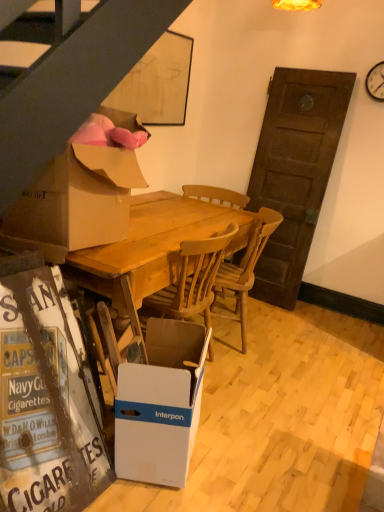
The image size is (384, 512). What do you see at coordinates (245, 269) in the screenshot?
I see `wooden chair at center` at bounding box center [245, 269].

This screenshot has height=512, width=384. What do you see at coordinates (161, 404) in the screenshot? I see `white cardboard box at lower center, acting as the first box starting from the bottom` at bounding box center [161, 404].

This screenshot has height=512, width=384. I want to click on white cardboard at lower left, so click(x=45, y=404).

Locate an element on the screen. wooden chair at center is located at coordinates (245, 269).

Between white plastic clock at upper right and wooden table at center, which one has more height?

wooden table at center.

From a real-world perspective, who is located higher, white plastic clock at upper right or wooden table at center?

white plastic clock at upper right is physically above.

From the image's perspective, is white plastic clock at upper right below wooden table at center?

No, from the image's perspective, white plastic clock at upper right is not below wooden table at center.

Is point (367, 77) more distant than point (161, 211)?

Yes, point (367, 77) is farther from viewer.

Who is bigger, white plastic clock at upper right or cardboard box at left, the 1th box in the top-to-bottom sequence?

cardboard box at left, the 1th box in the top-to-bottom sequence.

Can we say white plastic clock at upper right lies outside cardboard box at left, the 1th box in the top-to-bottom sequence?

white plastic clock at upper right is positioned outside cardboard box at left, the 1th box in the top-to-bottom sequence.

Is white plastic clock at upper right positioned in front of cardboard box at left, the 2th box from the bottom?

No.

Would you consider white plastic clock at upper right to be distant from cardboard box at left, the 2th box from the bottom?

white plastic clock at upper right is positioned a significant distance from cardboard box at left, the 2th box from the bottom.

Consider the image. From a real-world perspective, which is physically above, wooden table at center or white cardboard at lower left?

wooden table at center, from a real-world perspective.

Can you tell me how much wooden table at center and white cardboard at lower left differ in facing direction?

The angle between the facing direction of wooden table at center and the facing direction of white cardboard at lower left is 176 degrees.

Considering the sizes of objects wooden table at center and white cardboard at lower left in the image provided, who is taller, wooden table at center or white cardboard at lower left?

white cardboard at lower left.

Is white cardboard at lower left at the back of wooden table at center?

No, white cardboard at lower left is not at the back of wooden table at center.

Is wooden chair at center positioned before white cardboard at lower left?

No, wooden chair at center is further to the viewer.

Can we say wooden chair at center lies outside white cardboard at lower left?

Indeed, wooden chair at center is completely outside white cardboard at lower left.

Which is more to the left, wooden chair at center or white cardboard at lower left?

Positioned to the left is white cardboard at lower left.

From the image's perspective, is white plastic clock at upper right on white cardboard at lower left?

Indeed, from the image's perspective, white plastic clock at upper right is shown above white cardboard at lower left.

Where is `clock above the white cardboard at lower left (from a real-world perspective)`? clock above the white cardboard at lower left (from a real-world perspective) is located at coordinates (376, 82).

From a real-world perspective, between white plastic clock at upper right and white cardboard at lower left, who is vertically higher?

white plastic clock at upper right, from a real-world perspective.

Is the position of white plastic clock at upper right more distant than that of white cardboard at lower left?

Yes, it is.

Is wooden chair at center inside the boundaries of white cardboard box at lower center, the 2th box positioned from the top, or outside?

wooden chair at center lies outside white cardboard box at lower center, the 2th box positioned from the top.

Visually, is wooden chair at center positioned to the left or to the right of white cardboard box at lower center, the 2th box positioned from the top?

wooden chair at center is positioned on white cardboard box at lower center, the 2th box positioned from the top,'s right side.

Does wooden chair at center have a lesser height compared to white cardboard box at lower center, the 2th box positioned from the top?

Incorrect, the height of wooden chair at center does not fall short of that of white cardboard box at lower center, the 2th box positioned from the top.

Considering the sizes of objects white cardboard at lower left and white plastic clock at upper right in the image provided, who is shorter, white cardboard at lower left or white plastic clock at upper right?

white plastic clock at upper right.

Is white cardboard at lower left closer to camera compared to white plastic clock at upper right?

Yes, white cardboard at lower left is in front of white plastic clock at upper right.

From the image's perspective, is white cardboard at lower left below white plastic clock at upper right?

Yes, from the image's perspective, white cardboard at lower left is below white plastic clock at upper right.

Can you confirm if white cardboard at lower left is wider than white plastic clock at upper right?

Yes, white cardboard at lower left is wider than white plastic clock at upper right.

The width and height of the screenshot is (384, 512). I want to click on round table in front of the white plastic clock at upper right, so click(x=152, y=247).

You are a GUI agent. You are given a task and a screenshot of the screen. Output one action in this format:
    pyautogui.click(x=<x>, y=<y>)
    Task: Click on the clock above the cardboard box at left, the 1th box in the top-to-bottom sequence (from the image's perspective)
    The image size is (384, 512).
    Given the screenshot: What is the action you would take?
    pyautogui.click(x=376, y=82)

From the image, which object appears to be nearer to white cardboard at lower left, white plastic clock at upper right or cardboard box at left, the 1th box in the top-to-bottom sequence?

cardboard box at left, the 1th box in the top-to-bottom sequence, lies closer to white cardboard at lower left than the other object.

Looking at the image, which one is located further to white plastic clock at upper right, cardboard box at left, the 2th box from the bottom, or white cardboard at lower left?

white cardboard at lower left lies further to white plastic clock at upper right than the other object.

Which object lies further to the anchor point white plastic clock at upper right, wooden chair at center or white cardboard at lower left?

Based on the image, white cardboard at lower left appears to be further to white plastic clock at upper right.

Considering their positions, is wooden table at center positioned further to white cardboard box at lower center, acting as the first box starting from the bottom, than white cardboard at lower left?

Based on the image, wooden table at center appears to be further to white cardboard box at lower center, acting as the first box starting from the bottom.

Based on their spatial positions, is white cardboard box at lower center, the 2th box positioned from the top, or cardboard box at left, the 1th box in the top-to-bottom sequence, further from wooden table at center?

white cardboard box at lower center, the 2th box positioned from the top, is further to wooden table at center.

Based on their spatial positions, is white cardboard at lower left or white plastic clock at upper right closer to wooden chair at center?

Among the two, white cardboard at lower left is located nearer to wooden chair at center.

Considering their positions, is white plastic clock at upper right positioned closer to wooden chair at center than white cardboard box at lower center, acting as the first box starting from the bottom?

white cardboard box at lower center, acting as the first box starting from the bottom, is closer to wooden chair at center.

Which object lies nearer to the anchor point wooden chair at center, white plastic clock at upper right or cardboard box at left, the 2th box from the bottom?

Based on the image, cardboard box at left, the 2th box from the bottom, appears to be nearer to wooden chair at center.

Where is `bulletin board between cardboard box at left, the 2th box from the bottom, and white cardboard box at lower center, the 2th box positioned from the top, from top to bottom`? Image resolution: width=384 pixels, height=512 pixels. bulletin board between cardboard box at left, the 2th box from the bottom, and white cardboard box at lower center, the 2th box positioned from the top, from top to bottom is located at coordinates (45, 404).

This screenshot has height=512, width=384. I want to click on chair located between cardboard box at left, the 2th box from the bottom, and white plastic clock at upper right in the left-right direction, so click(x=245, y=269).

Image resolution: width=384 pixels, height=512 pixels. I want to click on round table that lies between cardboard box at left, the 2th box from the bottom, and white cardboard at lower left from top to bottom, so click(152, 247).

Locate an element on the screen. round table between white cardboard at lower left and wooden chair at center from front to back is located at coordinates (152, 247).